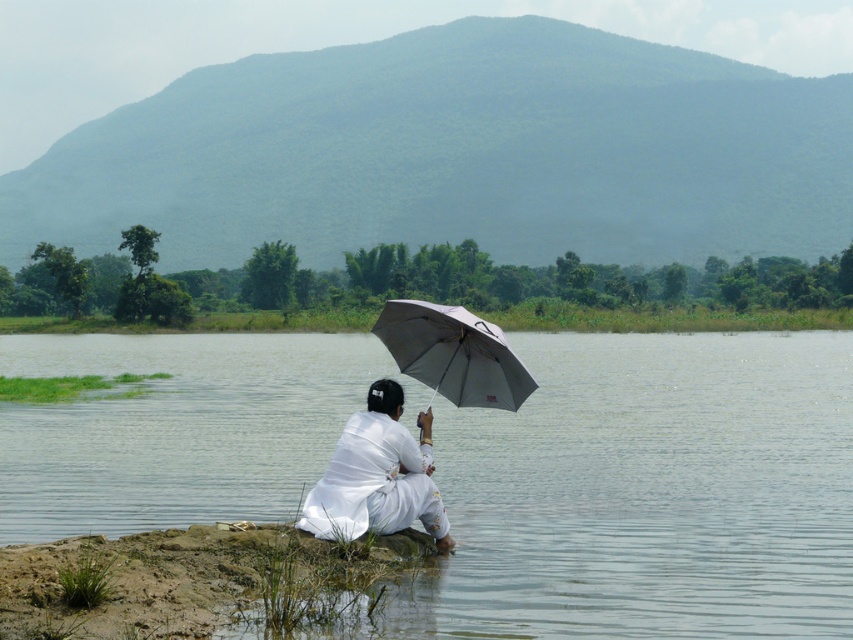
You are standing at the edge of the scene and want to step onto the clear water at lower center. Based on its position, is it safe to walk directly towards it from your current position?

The clear water at lower center is located at point (650, 492), so yes, you can safely walk directly towards it from your current position at the edge of the scene.